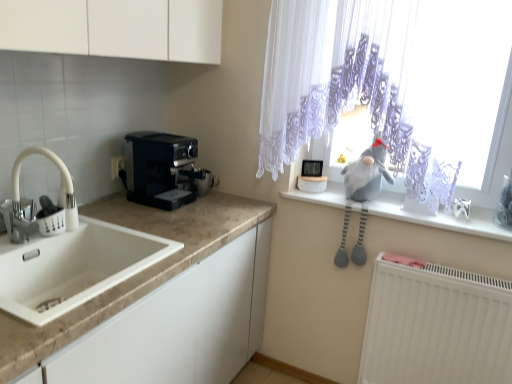
You are a GUI agent. You are given a task and a screenshot of the screen. Output one action in this format:
    pyautogui.click(x=<x>, y=<y>)
    Task: Click on the white lace curtain at upper right
    The width and height of the screenshot is (512, 384).
    Given the screenshot: What is the action you would take?
    pyautogui.click(x=457, y=82)

This screenshot has width=512, height=384. Describe the element at coordinates (457, 82) in the screenshot. I see `white lace curtain at upper right` at that location.

What do you see at coordinates (117, 166) in the screenshot? I see `white plastic electric outlet at left` at bounding box center [117, 166].

This screenshot has height=384, width=512. I want to click on black plastic coffee maker at left, so click(161, 169).

Identify the location of gray fabric at upper right. pos(440,218).

What is the approximate width of gray fabric at upper right?

The width of gray fabric at upper right is 11.21 inches.

Measure the distance between white marble countertop at lower left and camera.

33.77 inches.

What is the approximate height of white marble countertop at lower left?

The height of white marble countertop at lower left is 8.74 inches.

Find the location of a particular element. white lace curtain at upper right is located at coordinates (457, 82).

Considering the positions of points (56, 208) and (478, 210), is point (56, 208) farther from camera compared to point (478, 210)?

No, it is in front of (478, 210).

Between white matte faucet at left and gray fabric at upper right, which one appears on the left side from the viewer's perspective?

Positioned to the left is white matte faucet at left.

Is white matte faucet at left far away from gray fabric at upper right?

Yes, white matte faucet at left and gray fabric at upper right are quite far apart.

Would you say white matte faucet at left contains gray fabric at upper right?

Actually, gray fabric at upper right is outside white matte faucet at left.

Is gray fabric at upper right not close to white plastic electric outlet at left?

Yes, gray fabric at upper right is far from white plastic electric outlet at left.

Considering the sizes of gray fabric at upper right and white plastic electric outlet at left in the image, is gray fabric at upper right taller or shorter than white plastic electric outlet at left?

In the image, gray fabric at upper right appears to be shorter than white plastic electric outlet at left.

Is gray fabric at upper right wider than white plastic electric outlet at left?

Yes.

Choose the correct answer: Is gray fabric at upper right inside white plastic electric outlet at left or outside it?

gray fabric at upper right exists outside the volume of white plastic electric outlet at left.

Looking at their sizes, would you say white matte faucet at left is wider or thinner than white lace curtain at upper right?

In the image, white matte faucet at left appears to be wider than white lace curtain at upper right.

This screenshot has width=512, height=384. What are the coordinates of `tap located on the left of white lace curtain at upper right` in the screenshot? It's located at (46, 210).

Does white matte faucet at left turn towards white lace curtain at upper right?

No.

Is point (17, 188) more distant than point (289, 134)?

No.

From the image's perspective, who appears lower, black plastic coffee maker at left or white matte radiator at lower right?

white matte radiator at lower right is shown below in the image.

Based on the photo, looking at the image, does black plastic coffee maker at left seem bigger or smaller compared to white matte radiator at lower right?

Considering their sizes, black plastic coffee maker at left takes up less space than white matte radiator at lower right.

In the image, is black plastic coffee maker at left positioned in front of or behind white matte radiator at lower right?

black plastic coffee maker at left is positioned farther from the viewer than white matte radiator at lower right.

This screenshot has height=384, width=512. What are the coordinates of `window on the left of gray fabric at upper right` in the screenshot? It's located at (457, 82).

Would you say gray fabric at upper right is to the left or to the right of white lace curtain at upper right in the picture?

In the image, gray fabric at upper right appears on the right side of white lace curtain at upper right.

Which object is further away from the camera taking this photo, gray fabric at upper right or white lace curtain at upper right?

gray fabric at upper right.

Is white lace curtain at upper right aimed at black plastic coffee maker at left?

No, white lace curtain at upper right does not turn towards black plastic coffee maker at left.

Which of these two, white lace curtain at upper right or black plastic coffee maker at left, stands taller?

white lace curtain at upper right.

Considering the sizes of white lace curtain at upper right and black plastic coffee maker at left in the image, is white lace curtain at upper right bigger or smaller than black plastic coffee maker at left?

In the image, white lace curtain at upper right appears to be larger than black plastic coffee maker at left.

Is point (508, 140) more distant than point (177, 204)?

No.

From a real-world perspective, which object rests below the other?

white matte radiator at lower right, from a real-world perspective.

Is white matte radiator at lower right not near gray fabric at upper right?

Actually, white matte radiator at lower right and gray fabric at upper right are a little close together.

Considering the points (387, 323) and (386, 198), which point is behind, point (387, 323) or point (386, 198)?

The point (386, 198) is farther from the camera.

Considering the sizes of objects white matte radiator at lower right and gray fabric at upper right in the image provided, who is shorter, white matte radiator at lower right or gray fabric at upper right?

gray fabric at upper right is shorter.

This screenshot has height=384, width=512. Identify the location of window sill on the right of white matte faucet at left. (440, 218).

Identify the location of electric outlet behind the gray fabric at upper right. This screenshot has height=384, width=512. (117, 166).

Looking at the image, which one is located further to white plastic electric outlet at left, black plastic coffee maker at left or white matte radiator at lower right?

white matte radiator at lower right is positioned further to the anchor white plastic electric outlet at left.

From the image, which object appears to be farther from white marble countertop at lower left, white lace curtain at upper right or white matte faucet at left?

Among the two, white lace curtain at upper right is located further to white marble countertop at lower left.

Consider the image. Looking at the image, which one is located further to white matte faucet at left, white plastic electric outlet at left or white marble countertop at lower left?

white plastic electric outlet at left lies further to white matte faucet at left than the other object.

Based on their spatial positions, is white matte radiator at lower right or white plastic electric outlet at left further from black plastic coffee maker at left?

Among the two, white matte radiator at lower right is located further to black plastic coffee maker at left.

Considering their positions, is gray fabric at upper right positioned closer to white matte faucet at left than black plastic coffee maker at left?

Based on the image, black plastic coffee maker at left appears to be nearer to white matte faucet at left.

Estimate the real-world distances between objects in this image. Which object is further from white marble countertop at lower left, gray fabric at upper right or white matte faucet at left?

gray fabric at upper right.

Based on their spatial positions, is white marble countertop at lower left or white plastic electric outlet at left further from white lace curtain at upper right?

white plastic electric outlet at left is further to white lace curtain at upper right.

Considering their positions, is white plastic electric outlet at left positioned closer to white lace curtain at upper right than white marble countertop at lower left?

white marble countertop at lower left lies closer to white lace curtain at upper right than the other object.

The height and width of the screenshot is (384, 512). In order to click on coffee maker located between white matte faucet at left and gray fabric at upper right in the left-right direction in this screenshot , I will do `click(161, 169)`.

You are a GUI agent. You are given a task and a screenshot of the screen. Output one action in this format:
    pyautogui.click(x=<x>, y=<y>)
    Task: Click on the tap positioned between white marble countertop at lower left and white plastic electric outlet at left from near to far
    This screenshot has height=384, width=512.
    Given the screenshot: What is the action you would take?
    click(x=46, y=210)

This screenshot has height=384, width=512. Find the location of `window located between white plastic electric outlet at left and gray fabric at upper right in the left-right direction`. window located between white plastic electric outlet at left and gray fabric at upper right in the left-right direction is located at coordinates (457, 82).

Where is `coffee maker between white plastic electric outlet at left and gray plush toy at upper right in the horizontal direction`? coffee maker between white plastic electric outlet at left and gray plush toy at upper right in the horizontal direction is located at coordinates (161, 169).